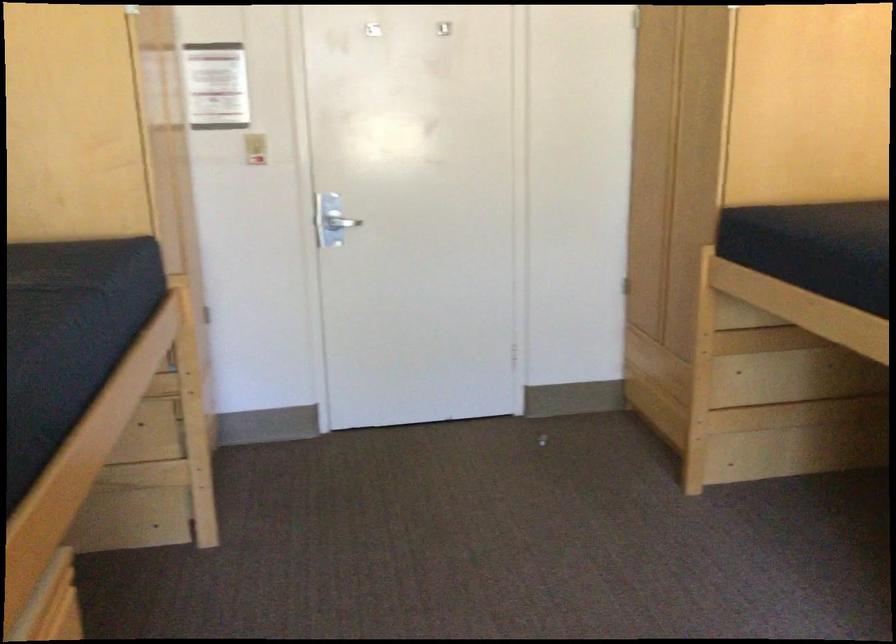
Find the location of a particular element. This screenshot has width=896, height=644. wall power outlet is located at coordinates (255, 147).